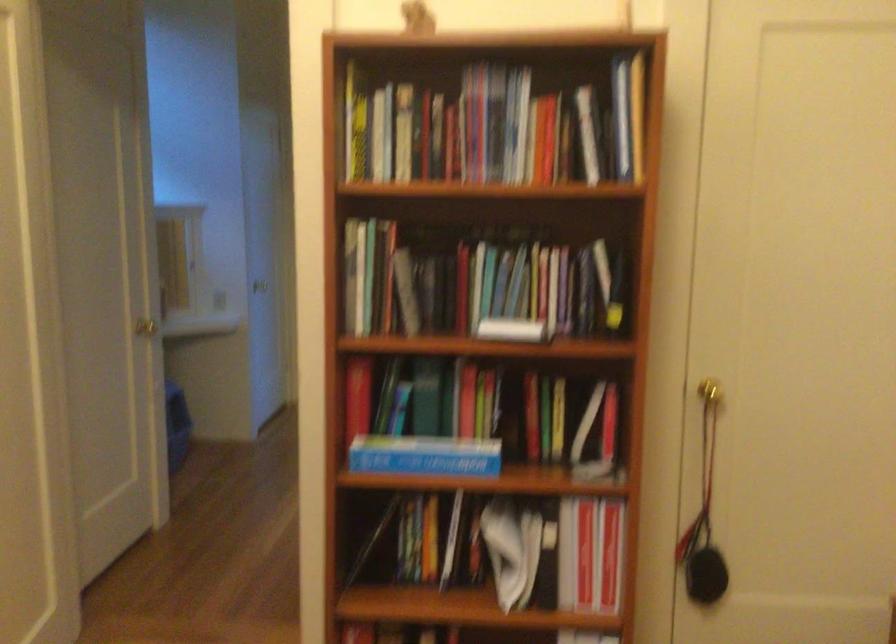
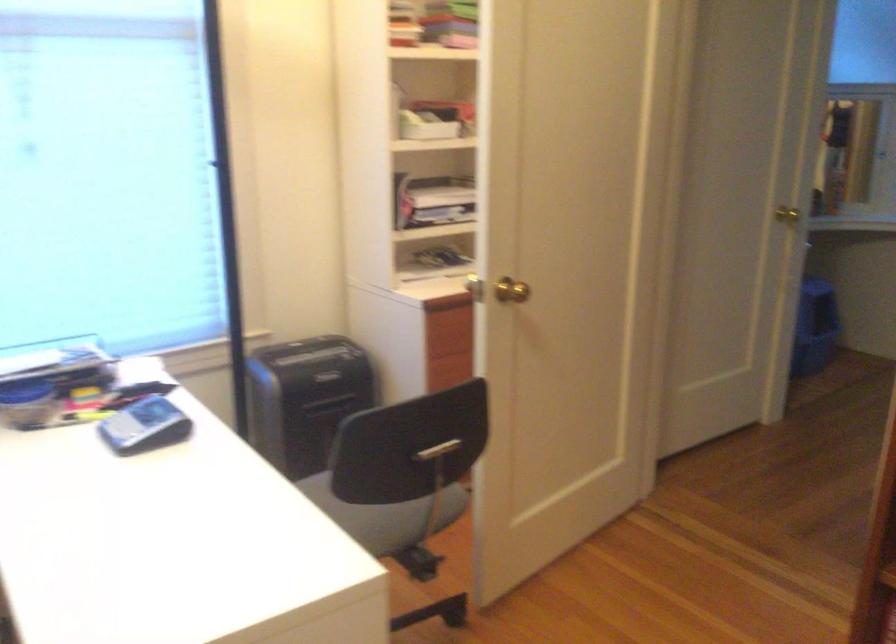
Question: How did the camera likely rotate?

Choices:
 (A) Left
 (B) Right
 (C) Up
 (D) Down

Answer: (A)